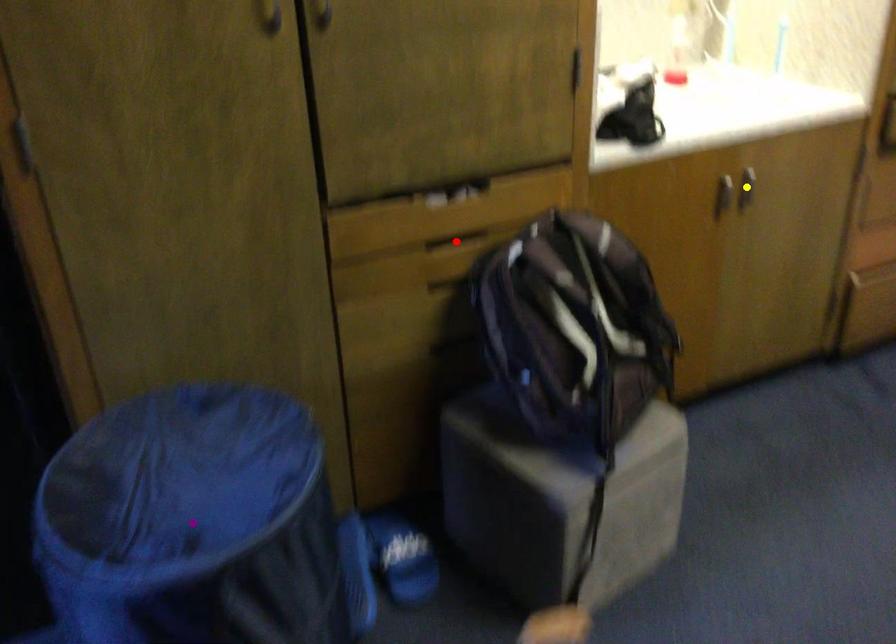
Order these from nearest to farthest:
A) purple point
B) yellow point
C) red point

purple point, red point, yellow point